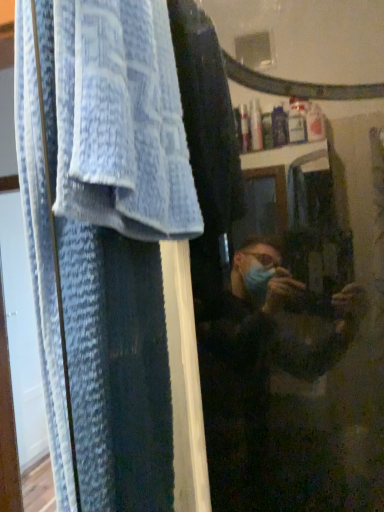
The height and width of the screenshot is (512, 384). Describe the element at coordinates (103, 238) in the screenshot. I see `blue textured towel at upper left` at that location.

Identify the location of blue textured towel at upper left. (103, 238).

What is the approximate width of blue textured towel at upper left?

blue textured towel at upper left is 6.21 inches wide.

This screenshot has width=384, height=512. I want to click on blue textured towel at upper left, so click(x=103, y=238).